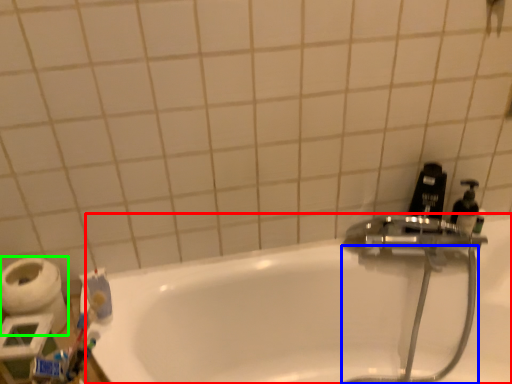
Question: Which is farther away from bathtub (highlighted by a red box)? garden hose (highlighted by a blue box) or toilet paper (highlighted by a green box)?

Choices:
 (A) garden hose
 (B) toilet paper

Answer: (B)